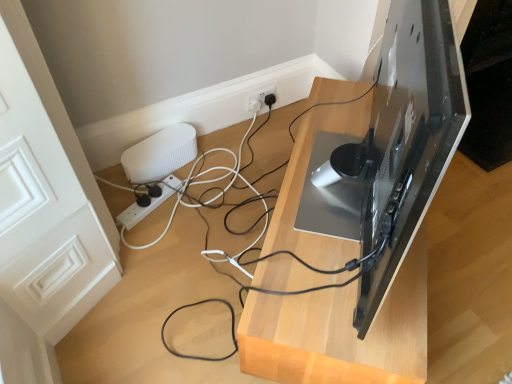
Where is `vacant space to the left of black glossy tv stand at upper right`? This screenshot has width=512, height=384. vacant space to the left of black glossy tv stand at upper right is located at coordinates (184, 263).